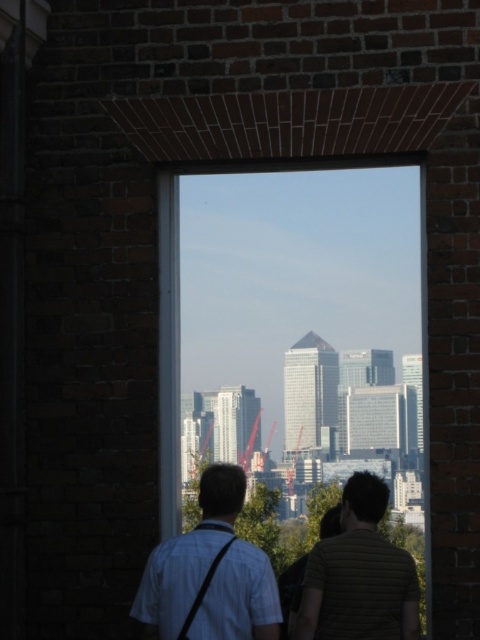
You are an architect designing a new building. You want to ensure that the metallic red crane at center can be seen clearly through the transparent glass window at center from the inside of the building. Based on the scene, is this possible?

The transparent glass window at center is in front of the metallic red crane at center, so the crane cannot be seen through the window from the inside of the building because the window is blocking the view.

You are trying to decide which shirt to wear for a job interview. Both the light blue shirt at center and the striped cotton shirt at center are hanging on a rack in front of you. Based on their sizes, which one might be more suitable for a professional setting?

The light blue shirt at center is much taller than the striped cotton shirt at center, so it might be more suitable for a professional setting as it appears more formal due to its larger size.